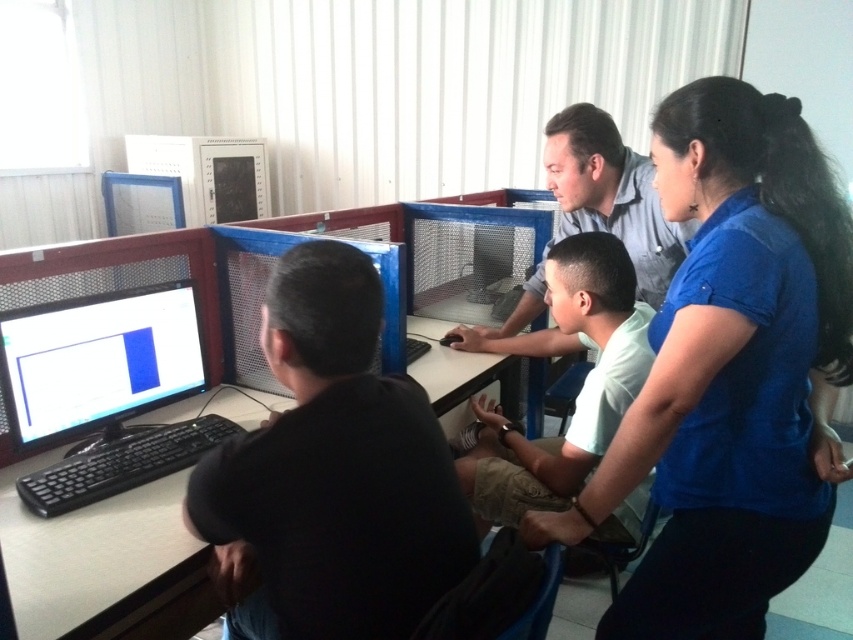
Question: Which point is closer to the camera?

Choices:
 (A) (543, 278)
 (B) (813, 496)
 (C) (258, 467)

Answer: (C)

Question: Considering the real-world distances, which object is closest to the matte gray shirt at center?

Choices:
 (A) blue fabric shirt at upper right
 (B) black matte shirt at left

Answer: (A)

Question: Does blue fabric shirt at upper right have a smaller size compared to matte gray shirt at center?

Choices:
 (A) no
 (B) yes

Answer: (B)

Question: Among these points, which one is farthest from the camera?

Choices:
 (A) (732, 250)
 (B) (326, 451)
 (C) (610, 138)
 (D) (13, 376)

Answer: (C)

Question: Is black matte shirt at left bigger than matte gray shirt at center?

Choices:
 (A) yes
 (B) no

Answer: (B)

Question: Can you confirm if blue fabric shirt at upper right is positioned above matte gray shirt at center?

Choices:
 (A) yes
 (B) no

Answer: (B)